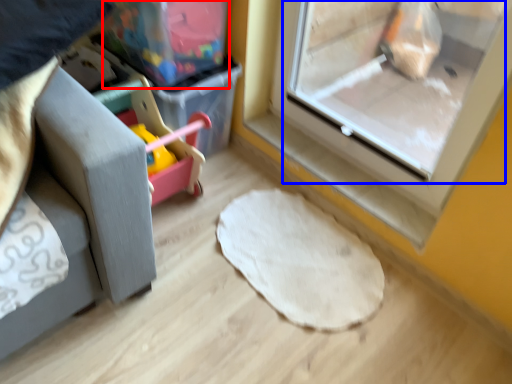
Question: Which point is closer to the camera, storage box (highlighted by a red box) or screen door (highlighted by a blue box)?

Choices:
 (A) storage box
 (B) screen door

Answer: (B)